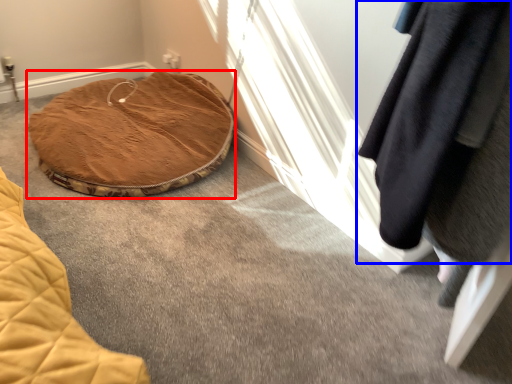
Question: Which of the following is the closest to the observer, furniture (highlighted by a red box) or clothing (highlighted by a blue box)?

Choices:
 (A) furniture
 (B) clothing

Answer: (B)